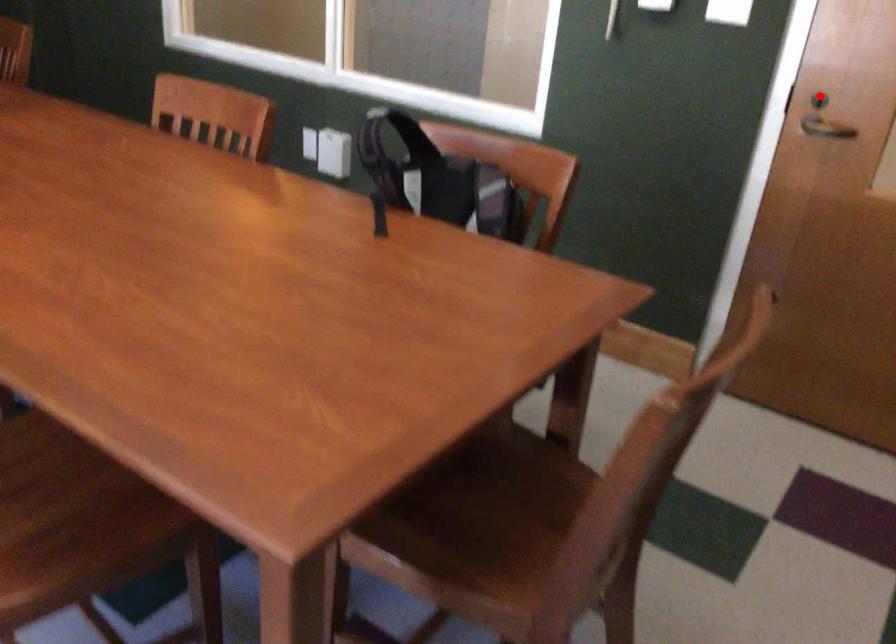
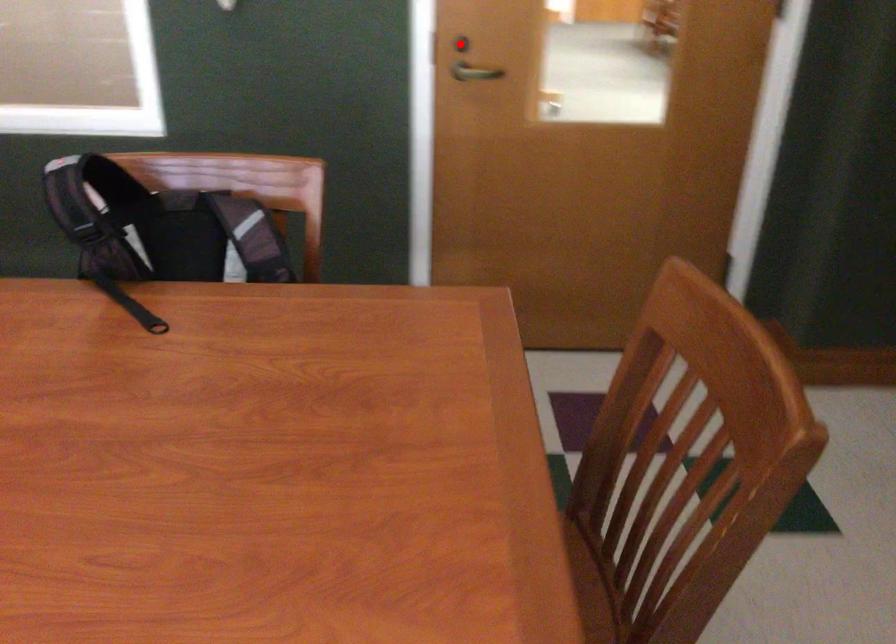
I am providing you with two images of the same scene from different viewpoints. A red point is marked on the first image and another point is marked on the second image. Do the highlighted points in image1 and image2 indicate the same real-world spot?

Yes